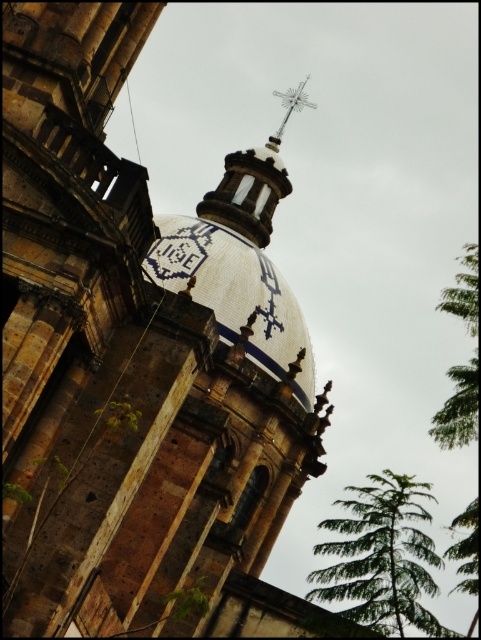
Question: Which point is farther to the camera?

Choices:
 (A) 299,387
 (B) 390,625
 (C) 476,369

Answer: (A)

Question: Which of the following is the closest to the observer?

Choices:
 (A) (160, 241)
 (B) (471, 259)
 (C) (278, 141)

Answer: (A)

Question: Does white ceramic dome at center come in front of green leafy tree at right?

Choices:
 (A) no
 (B) yes

Answer: (B)

Question: Is green needle-like tree at right smaller than green leafy tree at right?

Choices:
 (A) no
 (B) yes

Answer: (A)

Question: Can you confirm if green needle-like tree at right is bigger than green leafy tree at right?

Choices:
 (A) yes
 (B) no

Answer: (A)

Question: Among these objects, which one is nearest to the camera?

Choices:
 (A) white ceramic dome at center
 (B) silver metallic cross at upper center
 (C) green leafy tree at right

Answer: (A)